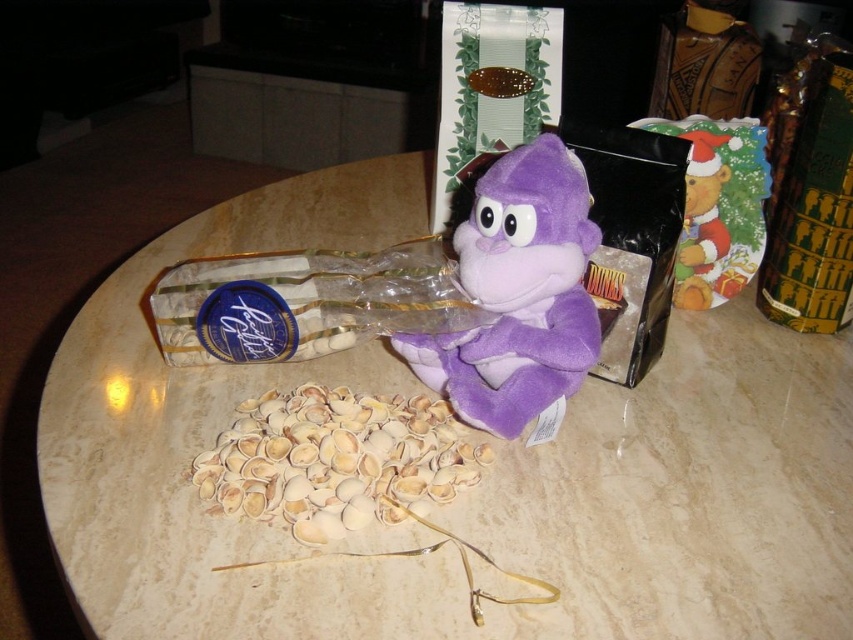
You are organizing items on a round table and notice the purple plush monkey at center and the light beige shell at center. Based on their positions, which item is placed higher up on the table?

The purple plush monkey at center is above the light beige shell at center, so it is placed higher up on the table.

You are organizing a birthday party and need to place a new gift on the table. The gift box is 20 cm in height. Can you place it on the marble table at center without it being taller than the purple plush monkey at center?

The marble table at center has a larger size compared to purple plush monkey at center. However, the question is about height. The description only mentions the size of the table and monkey, not their heights. Therefore, we cannot determine if the 20 cm gift box will be taller than the purple plush monkey at center based on the provided information.